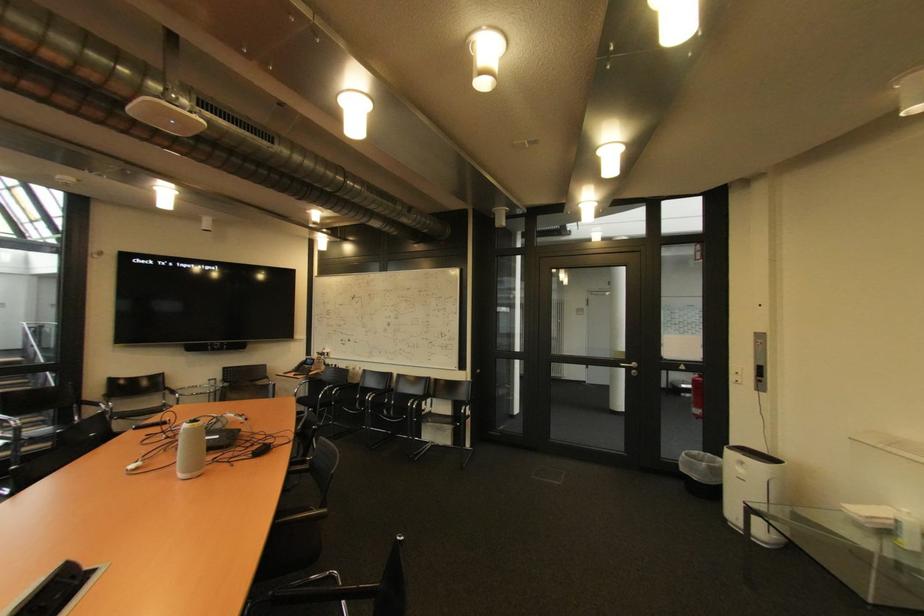
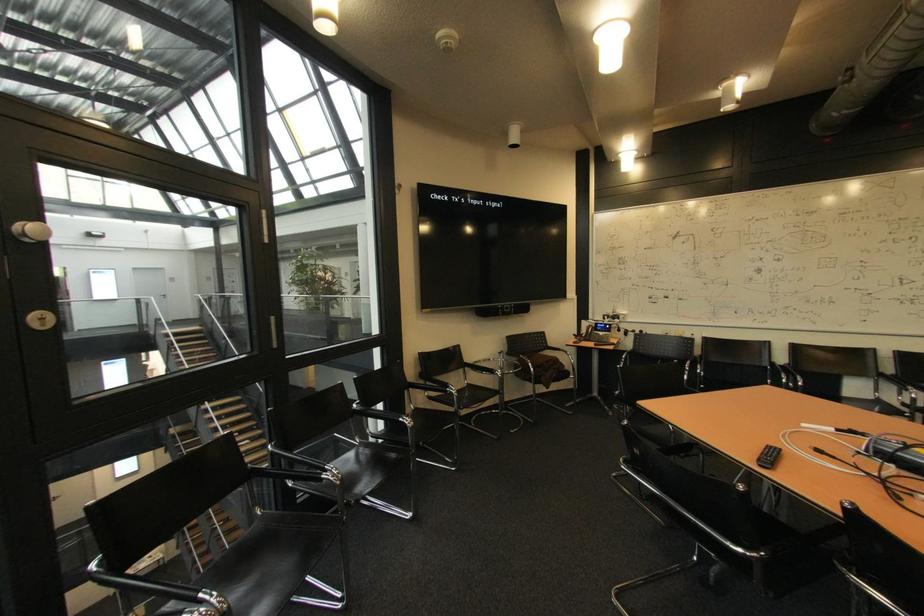
Question: In a continuous first-person perspective shot, in which direction is the camera moving?

Choices:
 (A) Left
 (B) Right
 (C) Forward
 (D) Backward

Answer: (A)